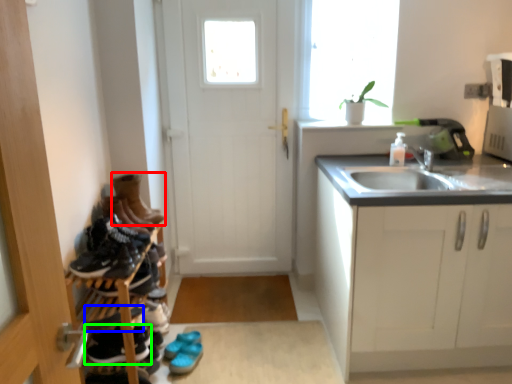
Question: Estimate the real-world distances between objects in this image. Which object is closer to footwear (highlighted by a red box), shoe (highlighted by a blue box) or footwear (highlighted by a green box)?

Choices:
 (A) shoe
 (B) footwear

Answer: (A)